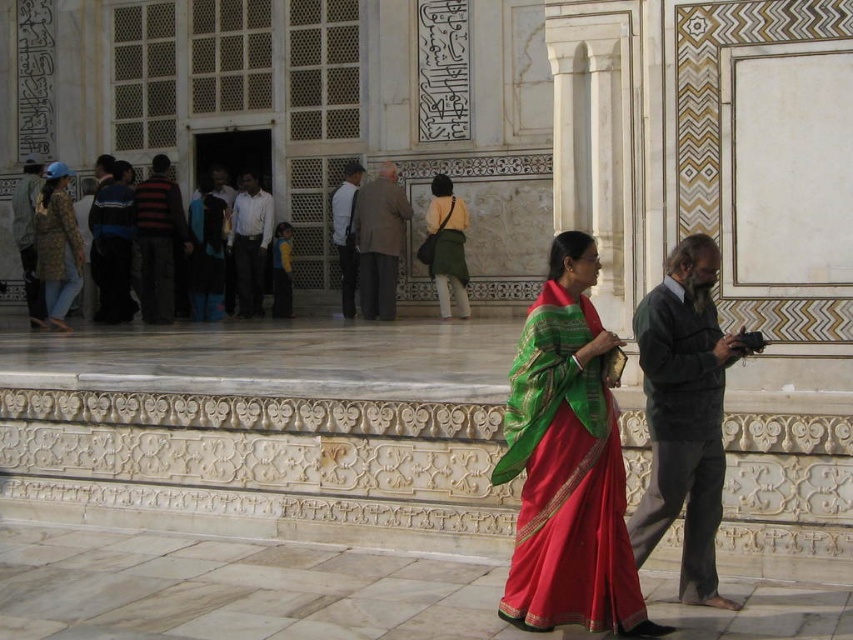
Which of these two, matte black clothing at center or light brown fabric coat at center, stands shorter?

matte black clothing at center

Which is above, matte black clothing at center or light brown fabric coat at center?

light brown fabric coat at center

Describe the element at coordinates (51, 252) in the screenshot. I see `matte black clothing at center` at that location.

You are a GUI agent. You are given a task and a screenshot of the screen. Output one action in this format:
    pyautogui.click(x=<x>, y=<y>)
    Task: Click on the matte black clothing at center
    
    Given the screenshot: What is the action you would take?
    pyautogui.click(x=51, y=252)

Is dark gray sweater at right smaller than patterned fabric jacket at left?

Indeed, dark gray sweater at right has a smaller size compared to patterned fabric jacket at left.

Who is taller, dark gray sweater at right or patterned fabric jacket at left?

patterned fabric jacket at left

Who is more distant from viewer, (723, 355) or (47, 278)?

The point (47, 278) is behind.

The height and width of the screenshot is (640, 853). I want to click on dark gray sweater at right, so click(x=683, y=413).

Is point (68, 250) more distant than point (347, 164)?

That is False.

Image resolution: width=853 pixels, height=640 pixels. Describe the element at coordinates (51, 252) in the screenshot. I see `matte black clothing at center` at that location.

Between point (62, 195) and point (346, 168), which one is positioned behind?

The point (346, 168) is behind.

Locate an element on the screen. Image resolution: width=853 pixels, height=640 pixels. matte black clothing at center is located at coordinates (51, 252).